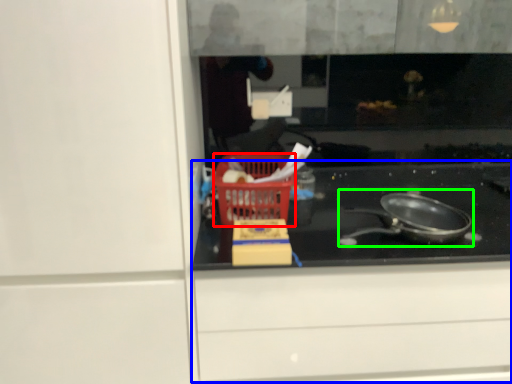
Question: Which object is the closest to the basket (highlighted by a red box)? Choose among these: cabinetry (highlighted by a blue box) or frying pan (highlighted by a green box).

Choices:
 (A) cabinetry
 (B) frying pan

Answer: (A)